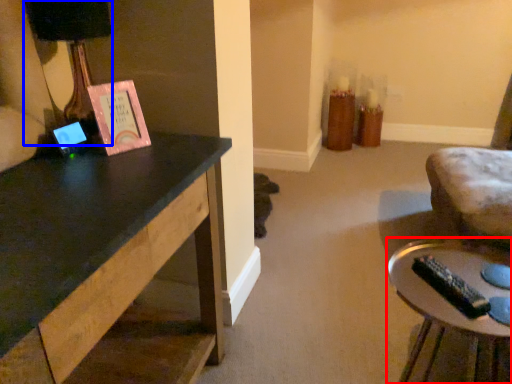
Question: Which of the following is the closest to the observer, table (highlighted by a red box) or table lamp (highlighted by a blue box)?

Choices:
 (A) table
 (B) table lamp

Answer: (A)